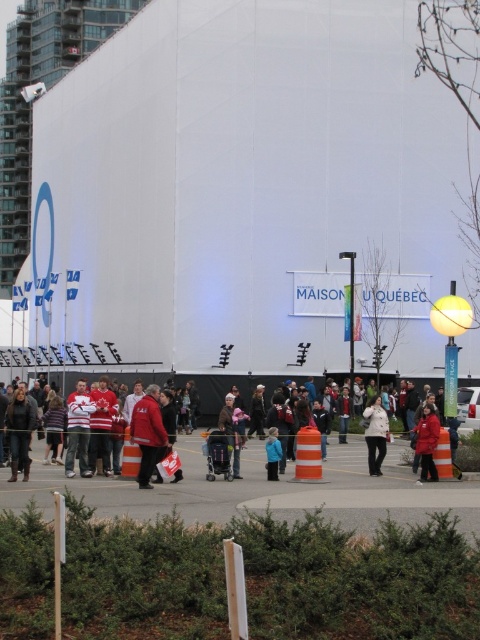
Question: Which is nearer to the red puffy coat at center?

Choices:
 (A) white matte jacket at center
 (B) orange reflective cone at center
 (C) white plastic sign at center
 (D) orange reflective traffic cone at center

Answer: (A)

Question: Is the position of white matte jacket at center less distant than that of orange reflective traffic cone at center?

Choices:
 (A) no
 (B) yes

Answer: (A)

Question: Does orange reflective traffic cone at center have a larger size compared to white matte sign at center?

Choices:
 (A) no
 (B) yes

Answer: (B)

Question: Based on their relative distances, which object is nearer to the orange reflective cone at center?

Choices:
 (A) dark brown leather jacket at lower left
 (B) red fleece jacket at center
 (C) white matte jacket at center
 (D) blue matte jacket at center

Answer: (B)

Question: From the image, what is the correct spatial relationship of dark brown leather jacket at lower left in relation to blue matte jacket at center?

Choices:
 (A) left
 (B) right

Answer: (A)

Question: Which point is farther to the camera?

Choices:
 (A) white matte jacket at center
 (B) orange reflective cone at center
 (C) orange reflective cone at lower right

Answer: (A)